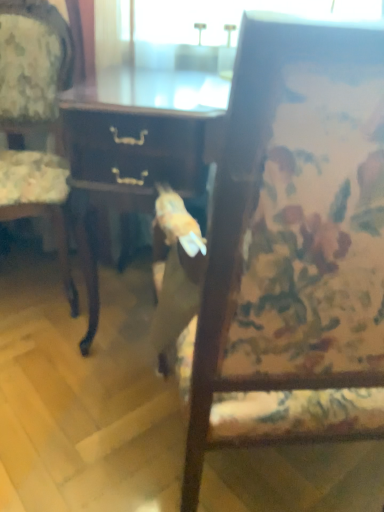
Find the location of a particular element. The width and height of the screenshot is (384, 512). free space in front of wooden desk at center is located at coordinates (75, 420).